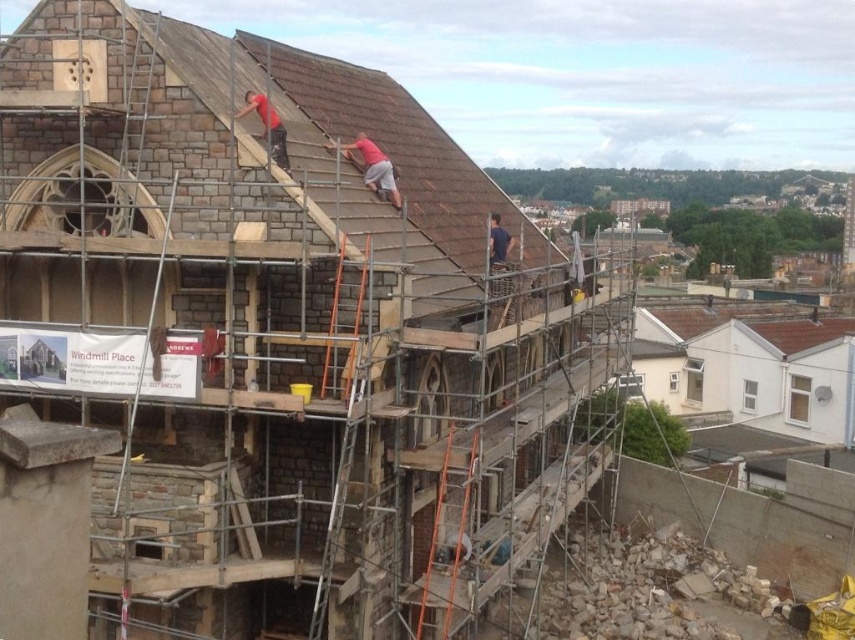
You are a construction worker looking at the Windmill Place building. You notice the brown tile roof at upper center and the red matte shirt at upper center. Which object is positioned to the left of the other?

The red matte shirt at upper center is to the left of the brown tile roof at upper center because the brown tile roof at upper center is to the right of the red matte shirt at upper center.

You are a contractor inspecting the construction site of the building with arched windows and a stone facade. You notice a point marked at coordinates (372,166). What object is located at this point?

The point at coordinates (372,166) indicates the location of the matte red shirt at upper center.